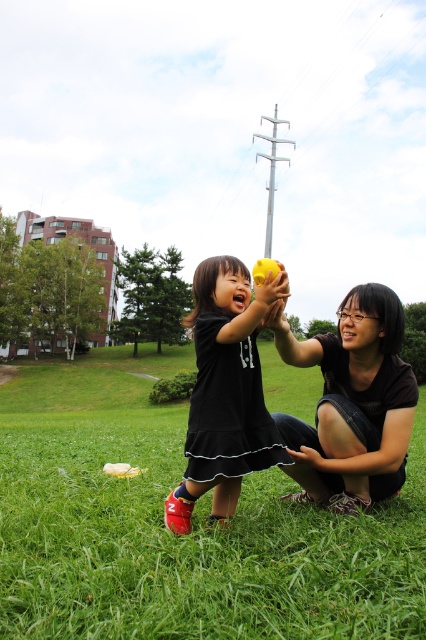
Question: Considering the real-world distances, which object is closest to the matte yellow ball at center?

Choices:
 (A) green grass at center
 (B) matte black shirt at center

Answer: (B)

Question: Does green grass at center have a smaller size compared to matte black shirt at center?

Choices:
 (A) yes
 (B) no

Answer: (B)

Question: Which of the following is the farthest from the observer?

Choices:
 (A) (164, 618)
 (B) (195, 355)

Answer: (B)

Question: Which object is farther from the camera taking this photo?

Choices:
 (A) green grass at center
 (B) matte yellow ball at center
 (C) matte black shirt at center

Answer: (C)

Question: In this image, where is matte black shirt at center located relative to matte yellow ball at center?

Choices:
 (A) left
 (B) right

Answer: (B)

Question: Can you confirm if green grass at center is thinner than matte black shirt at center?

Choices:
 (A) no
 (B) yes

Answer: (A)